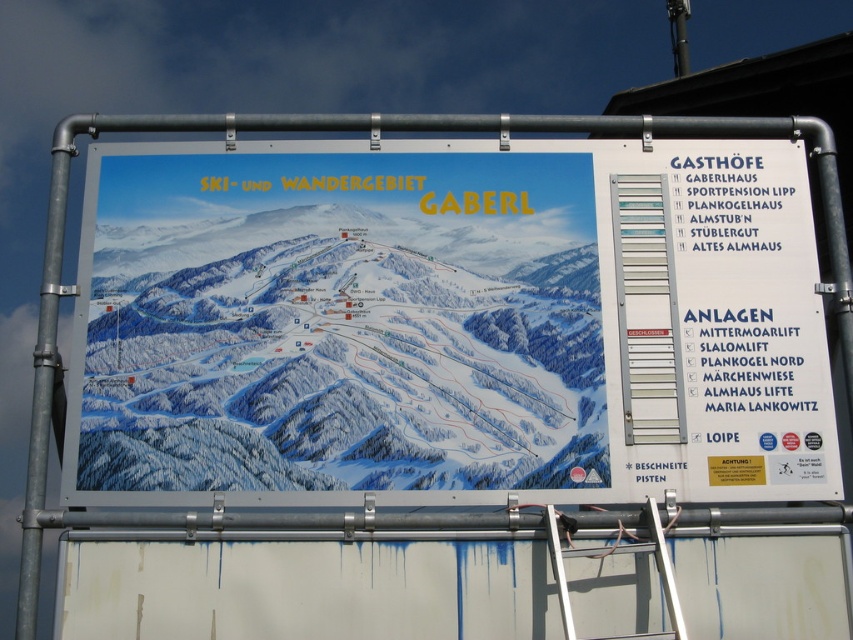
Question: Which of the following is the farthest from the observer?

Choices:
 (A) (567, 628)
 (B) (668, 326)

Answer: (B)

Question: Is silver metallic ladder at right above white plastic ladder at lower center?

Choices:
 (A) yes
 (B) no

Answer: (A)

Question: Is silver metallic ladder at right to the left of white plastic ladder at lower center from the viewer's perspective?

Choices:
 (A) yes
 (B) no

Answer: (B)

Question: Which point appears closest to the camera in this image?

Choices:
 (A) (635, 282)
 (B) (656, 522)

Answer: (B)

Question: Among these points, which one is nearest to the camera?

Choices:
 (A) 637,385
 (B) 674,636

Answer: (B)

Question: Does silver metallic ladder at right have a smaller size compared to white plastic ladder at lower center?

Choices:
 (A) no
 (B) yes

Answer: (B)